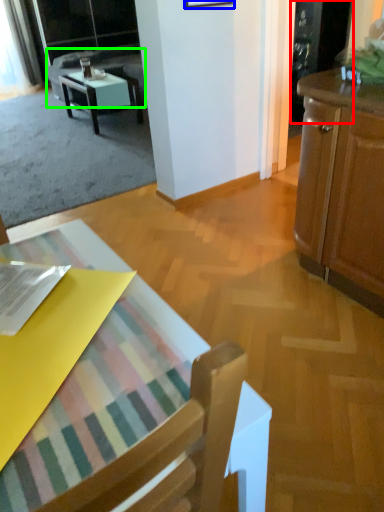
Question: Considering the real-world distances, which object is farthest from screen door (highlighted by a red box)? picture frame (highlighted by a blue box) or couch (highlighted by a green box)?

Choices:
 (A) picture frame
 (B) couch

Answer: (B)